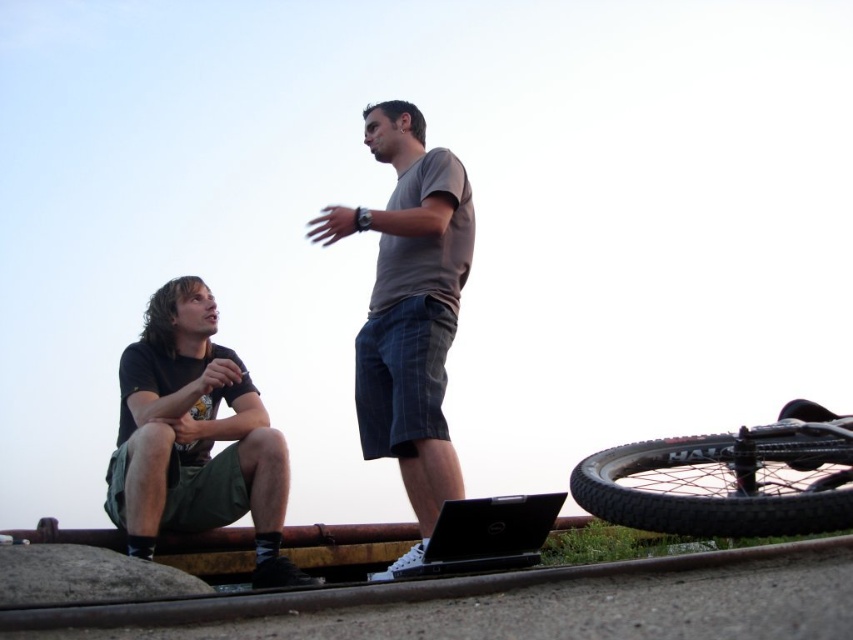
Question: Does dark green cotton shorts at left have a larger size compared to black matte laptop at lower center?

Choices:
 (A) no
 (B) yes

Answer: (B)

Question: Does matte gray t-shirt at center appear on the right side of black matte laptop at lower center?

Choices:
 (A) no
 (B) yes

Answer: (A)

Question: Which point is farther to the camera?

Choices:
 (A) black matte laptop at lower center
 (B) black rubber tire at lower right
 (C) matte gray t-shirt at center
 (D) dark green cotton shorts at left

Answer: (C)

Question: Which is farther from the dark green cotton shorts at left?

Choices:
 (A) black matte laptop at lower center
 (B) matte gray t-shirt at center

Answer: (B)

Question: Is black rubber tire at lower right bigger than black matte laptop at lower center?

Choices:
 (A) yes
 (B) no

Answer: (B)

Question: Which object is positioned farthest from the black rubber tire at lower right?

Choices:
 (A) black matte laptop at lower center
 (B) matte gray t-shirt at center
 (C) dark green cotton shorts at left

Answer: (B)